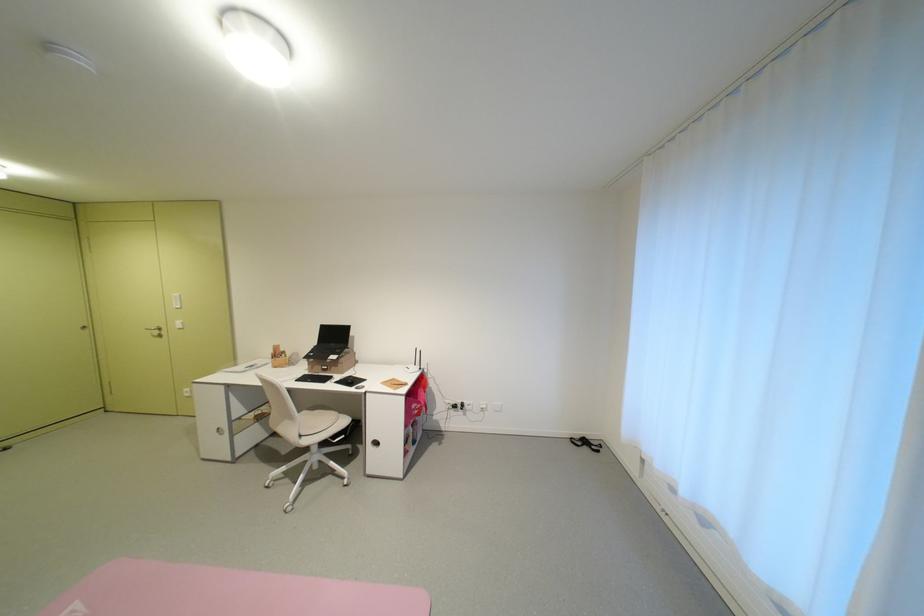
The height and width of the screenshot is (616, 924). What are the coordinates of `white light switch` in the screenshot? It's located at [176, 301].